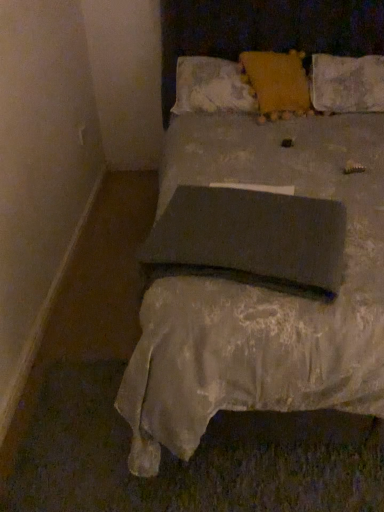
Question: Does dark gray fabric pillow at center, the 1th pillow from the front, have a smaller size compared to matte gray bed at center?

Choices:
 (A) yes
 (B) no

Answer: (A)

Question: Is matte gray bed at center inside dark gray fabric pillow at center, placed as the fourth pillow when sorted from back to front?

Choices:
 (A) no
 (B) yes

Answer: (A)

Question: Is dark gray fabric pillow at center, the 1th pillow from the front, outside matte gray bed at center?

Choices:
 (A) no
 (B) yes

Answer: (A)

Question: Is dark gray fabric pillow at center, placed as the fourth pillow when sorted from back to front, to the right of matte gray bed at center from the viewer's perspective?

Choices:
 (A) yes
 (B) no

Answer: (B)

Question: Can you confirm if dark gray fabric pillow at center, the 1th pillow from the front, is bigger than matte gray bed at center?

Choices:
 (A) no
 (B) yes

Answer: (A)

Question: Is point (218, 73) positioned closer to the camera than point (256, 307)?

Choices:
 (A) closer
 (B) farther

Answer: (B)

Question: Considering the positions of fluffy white pillow at upper center, the first pillow viewed from the back, and matte gray bed at center in the image, is fluffy white pillow at upper center, the first pillow viewed from the back, taller or shorter than matte gray bed at center?

Choices:
 (A) short
 (B) tall

Answer: (A)

Question: Looking at their shapes, would you say fluffy white pillow at upper center, the 4th pillow viewed from the front, is wider or thinner than matte gray bed at center?

Choices:
 (A) thin
 (B) wide

Answer: (A)

Question: From a real-world perspective, relative to matte gray bed at center, is fluffy white pillow at upper center, the first pillow viewed from the back, vertically above or below?

Choices:
 (A) above
 (B) below

Answer: (A)

Question: Is textured beige pillow at upper right, which ranks as the 2th pillow in back-to-front order, situated inside matte gray bed at center or outside?

Choices:
 (A) inside
 (B) outside

Answer: (A)

Question: From the image's perspective, is textured beige pillow at upper right, which ranks as the 2th pillow in back-to-front order, positioned above or below matte gray bed at center?

Choices:
 (A) below
 (B) above

Answer: (B)

Question: Visually, is textured beige pillow at upper right, which ranks as the 2th pillow in back-to-front order, positioned to the left or to the right of matte gray bed at center?

Choices:
 (A) left
 (B) right

Answer: (B)

Question: In terms of width, does textured beige pillow at upper right, which ranks as the 2th pillow in back-to-front order, look wider or thinner when compared to matte gray bed at center?

Choices:
 (A) wide
 (B) thin

Answer: (B)

Question: Looking at the image, does velvet orange pillow at upper center, the second pillow positioned from the front, seem bigger or smaller compared to fluffy white pillow at upper center, the 4th pillow viewed from the front?

Choices:
 (A) big
 (B) small

Answer: (B)

Question: Looking at their shapes, would you say velvet orange pillow at upper center, which is counted as the 3th pillow, starting from the back, is wider or thinner than fluffy white pillow at upper center, the first pillow viewed from the back?

Choices:
 (A) wide
 (B) thin

Answer: (A)